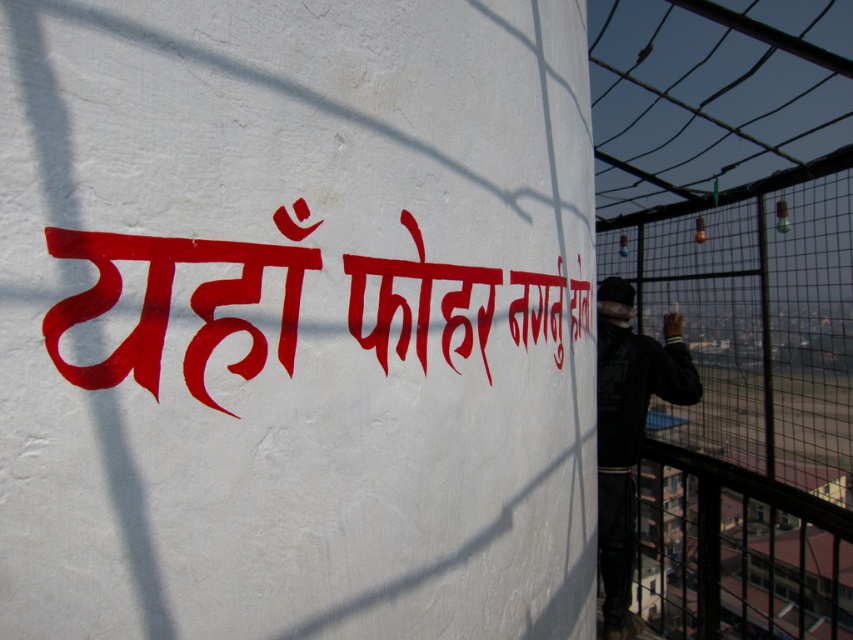
Can you confirm if black metal fence at right is bigger than dark blue jacket at right?

Yes.

Is black metal fence at right smaller than dark blue jacket at right?

No.

Who is more forward, (x=704, y=250) or (x=669, y=340)?

Point (x=669, y=340) is in front.

At what (x,y) coordinates should I click in order to perform the action: click on black metal fence at right. Please return your answer as a coordinate pair (x, y). The image size is (853, 640). Looking at the image, I should click on (747, 406).

Does point (432, 282) lie in front of point (653, 380)?

Yes, it is.

Which of these two, red painted text at center or dark blue jacket at right, stands taller?

dark blue jacket at right is taller.

Which is in front, point (119, 243) or point (605, 589)?

Point (119, 243) is more forward.

At what (x,y) coordinates should I click in order to perform the action: click on red painted text at center. Please return your answer as a coordinate pair (x, y). Looking at the image, I should click on (170, 304).

Locate an element on the screen. This screenshot has height=640, width=853. black metal fence at right is located at coordinates (747, 406).

Can you confirm if black metal fence at right is wider than red painted text at center?

Yes, black metal fence at right is wider than red painted text at center.

Is point (791, 408) positioned behind point (91, 252)?

Yes, point (791, 408) is farther from viewer.

This screenshot has height=640, width=853. I want to click on black metal fence at right, so click(x=747, y=406).